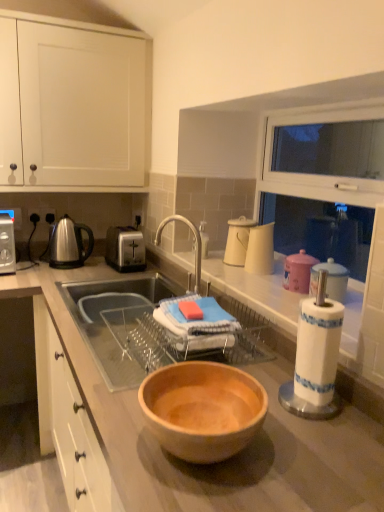
Question: Is white glossy cups at upper center, placed as the 3th appliance when sorted from front to back, further to the viewer compared to white glossy pitcher at upper right, which is counted as the 2th appliance, starting from the back?

Choices:
 (A) yes
 (B) no

Answer: (A)

Question: Is white glossy cups at upper center, placed as the 3th appliance when sorted from front to back, facing towards white glossy pitcher at upper right, which is counted as the 2th appliance, starting from the back?

Choices:
 (A) no
 (B) yes

Answer: (A)

Question: Is white glossy cups at upper center, placed as the 3th appliance when sorted from front to back, positioned far away from white glossy pitcher at upper right, which appears as the second appliance when viewed from the front?

Choices:
 (A) no
 (B) yes

Answer: (A)

Question: Considering the relative sizes of white glossy cups at upper center, the 1th appliance when ordered from back to front, and white glossy pitcher at upper right, which appears as the second appliance when viewed from the front, in the image provided, is white glossy cups at upper center, the 1th appliance when ordered from back to front, shorter than white glossy pitcher at upper right, which appears as the second appliance when viewed from the front,?

Choices:
 (A) no
 (B) yes

Answer: (A)

Question: Would you say white glossy cups at upper center, the 1th appliance when ordered from back to front, contains white glossy pitcher at upper right, which appears as the second appliance when viewed from the front?

Choices:
 (A) yes
 (B) no

Answer: (B)

Question: Does point (243, 249) appear closer or farther from the camera than point (125, 232)?

Choices:
 (A) closer
 (B) farther

Answer: (A)

Question: From a real-world perspective, is white glossy cups at upper center, the 1th appliance when ordered from back to front, above or below satin silver toaster at center?

Choices:
 (A) below
 (B) above

Answer: (B)

Question: Is white glossy cups at upper center, placed as the 3th appliance when sorted from front to back, in front of or behind satin silver toaster at center in the image?

Choices:
 (A) front
 (B) behind

Answer: (A)

Question: Visually, is white glossy cups at upper center, placed as the 3th appliance when sorted from front to back, positioned to the left or to the right of satin silver toaster at center?

Choices:
 (A) left
 (B) right

Answer: (B)

Question: Is point (329, 265) positioned closer to the camera than point (14, 288)?

Choices:
 (A) closer
 (B) farther

Answer: (A)

Question: In terms of width, does white paper towel holder at right, arranged as the first appliance when viewed from the front, look wider or thinner when compared to wooden bowl at center?

Choices:
 (A) thin
 (B) wide

Answer: (A)

Question: In terms of height, does white paper towel holder at right, arranged as the first appliance when viewed from the front, look taller or shorter compared to wooden bowl at center?

Choices:
 (A) short
 (B) tall

Answer: (A)

Question: In terms of size, does white paper towel holder at right, arranged as the first appliance when viewed from the front, appear bigger or smaller than wooden bowl at center?

Choices:
 (A) big
 (B) small

Answer: (B)

Question: Choose the correct answer: Is satin silver toaster at center inside wooden bowl at center or outside it?

Choices:
 (A) inside
 (B) outside

Answer: (A)

Question: From the image's perspective, relative to wooden bowl at center, is satin silver toaster at center above or below?

Choices:
 (A) below
 (B) above

Answer: (B)